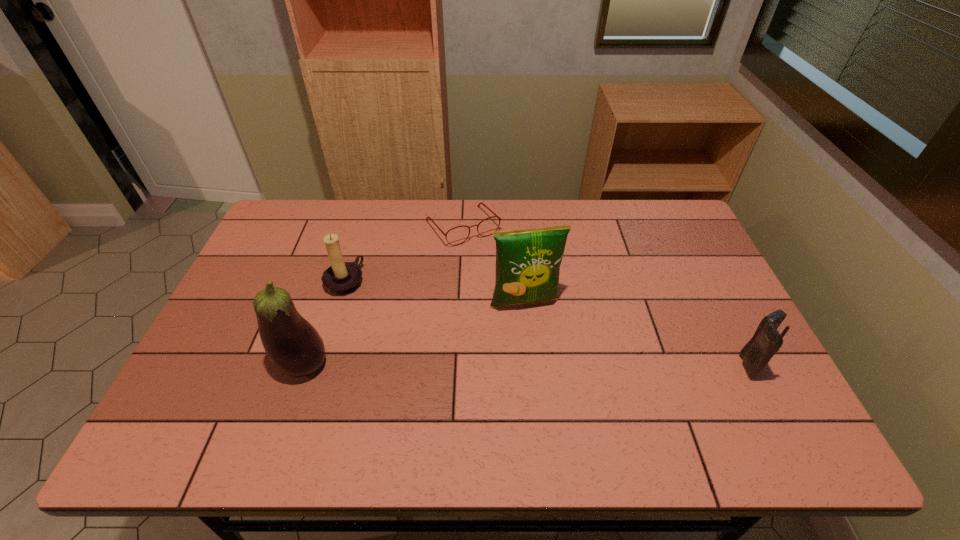
Identify the location of vacant space on the desktop that is between the eggplant and the rightmost object and is positioned on the wick of the candle holder. (517, 364).

At what (x,y) coordinates should I click in order to perform the action: click on vacant space on the desktop that is between the eggplant and the cellular telephone and is positioned on the face of the farthest object. Please return your answer as a coordinate pair (x, y). Looking at the image, I should click on (564, 364).

Locate an element on the screen. vacant spot on the desktop that is between the eggplant and the rightmost object and is positioned on the front-facing side of the crisp (potato chip) is located at coordinates (542, 364).